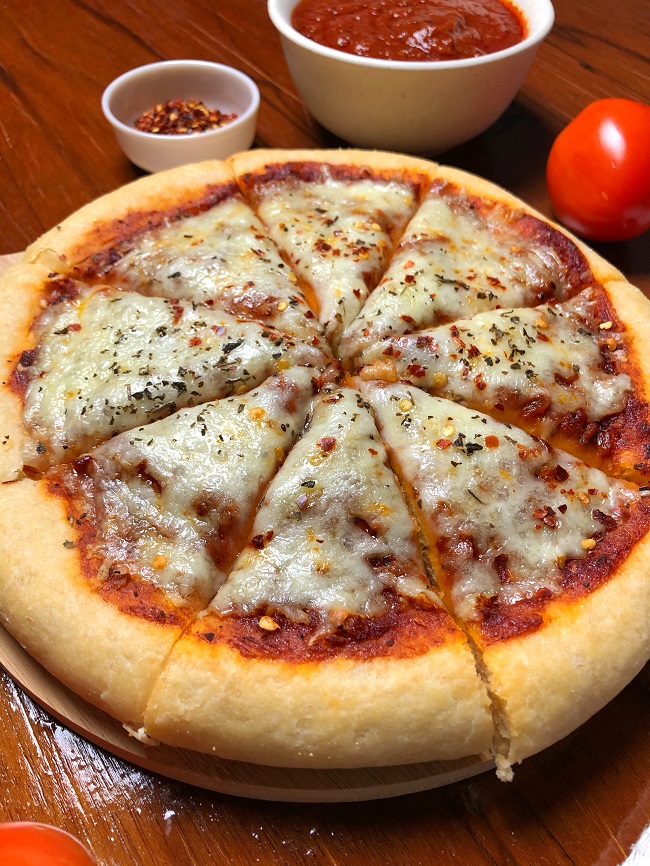
You are a GUI agent. You are given a task and a screenshot of the screen. Output one action in this format:
    pyautogui.click(x=<x>, y=<y>)
    Task: Click on the crumb
    Image resolution: width=650 pixels, height=866 pixels.
    Given the screenshot: What is the action you would take?
    pyautogui.click(x=161, y=808), pyautogui.click(x=263, y=830), pyautogui.click(x=313, y=843), pyautogui.click(x=285, y=842), pyautogui.click(x=322, y=825), pyautogui.click(x=127, y=803)